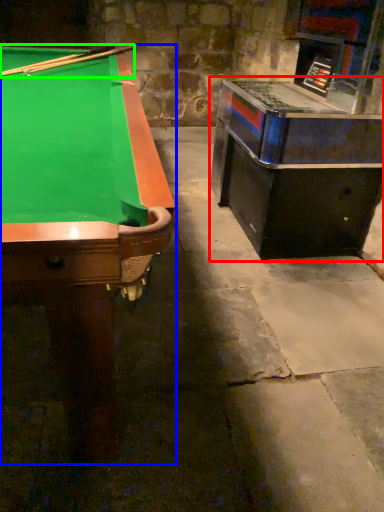
Question: Which is nearer to the table (highlighted by a red box)? billiard table (highlighted by a blue box) or cue (highlighted by a green box).

Choices:
 (A) billiard table
 (B) cue

Answer: (A)